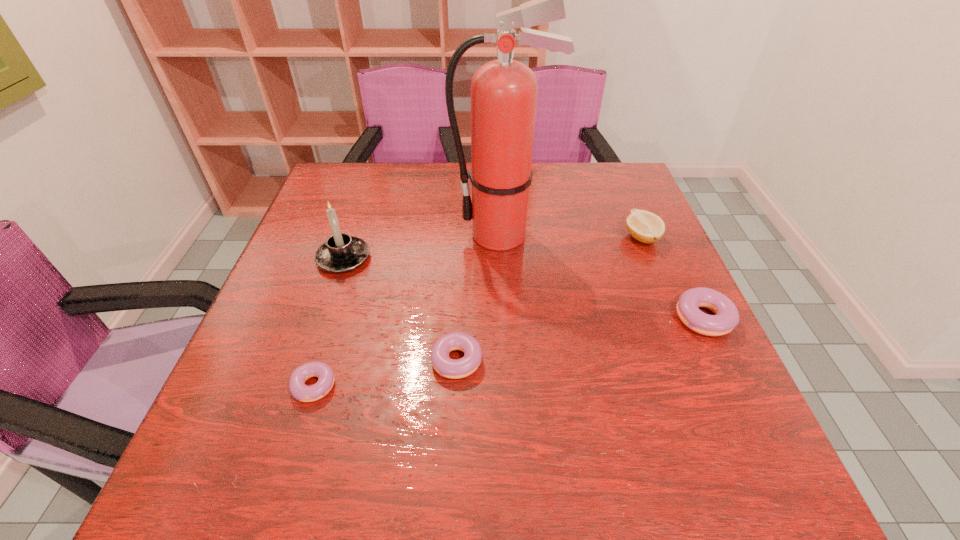
Identify which object is located as the fourth nearest to the lemon. Please provide its 2D coordinates. Your answer should be formatted as a tuple, i.e. [(x, y)], where the tuple contains the x and y coordinates of a point satisfying the conditions above.

[(341, 253)]

Locate which doughnut is the second closest to the second tallest doughnut. Please provide its 2D coordinates. Your answer should be formatted as a tuple, i.e. [(x, y)], where the tuple contains the x and y coordinates of a point satisfying the conditions above.

[(726, 317)]

This screenshot has height=540, width=960. Identify the location of doughnut that stands as the third closest to the fire extinguisher. (300, 391).

Find the location of `vacant point that satisfies the following two spatial constraints: 1. on the back side of the shortest object; 2. with a handle on the side of the fifth shortest object`. vacant point that satisfies the following two spatial constraints: 1. on the back side of the shortest object; 2. with a handle on the side of the fifth shortest object is located at coordinates (354, 258).

The image size is (960, 540). Find the location of `vacant region that satisfies the following two spatial constraints: 1. with a handle on the side of the candle holder; 2. on the right side of the shortest doughnut`. vacant region that satisfies the following two spatial constraints: 1. with a handle on the side of the candle holder; 2. on the right side of the shortest doughnut is located at coordinates (301, 385).

The image size is (960, 540). I want to click on vacant space that satisfies the following two spatial constraints: 1. on the hose direction of the fire extinguisher; 2. on the back side of the tallest doughnut, so click(506, 318).

Image resolution: width=960 pixels, height=540 pixels. In order to click on vacant space that satisfies the following two spatial constraints: 1. with a handle on the side of the third shortest object; 2. on the right side of the candle holder in this screenshot , I will do `click(324, 318)`.